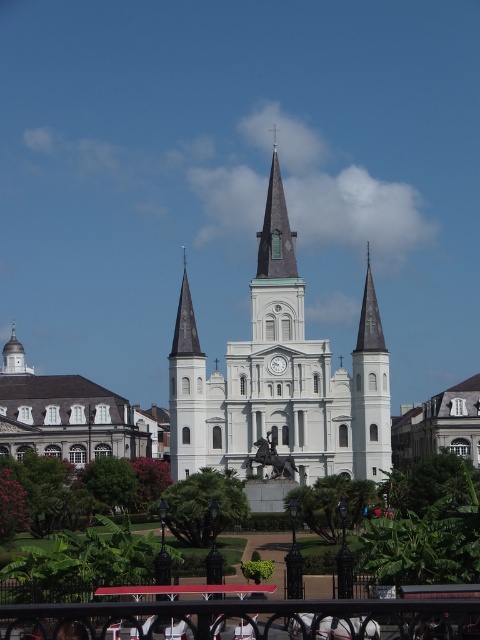
You are standing at the point marked as point (279, 378) in the image. What object is located exactly at this point?

The white stone clock tower at center is located exactly at point (279, 378).

You are a tourist standing in front of the cathedral and want to take a photo that includes both the white stone clock tower at center and the white stone church at center. Based on their positions, which one should you frame first in your camera viewfinder to ensure both are in the shot?

The white stone clock tower at center is located above the white stone church at center, so you should frame the white stone church at center first in your camera viewfinder to ensure both are in the shot since the clock tower is positioned above it.